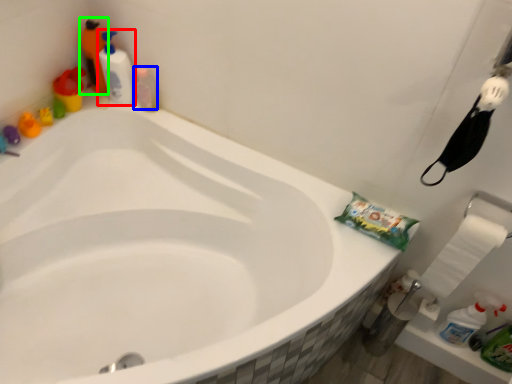
Question: Estimate the real-world distances between objects in this image. Which object is closer to cleaning product (highlighted by a red box), cleaning product (highlighted by a blue box) or cleaning product (highlighted by a green box)?

Choices:
 (A) cleaning product
 (B) cleaning product

Answer: (A)